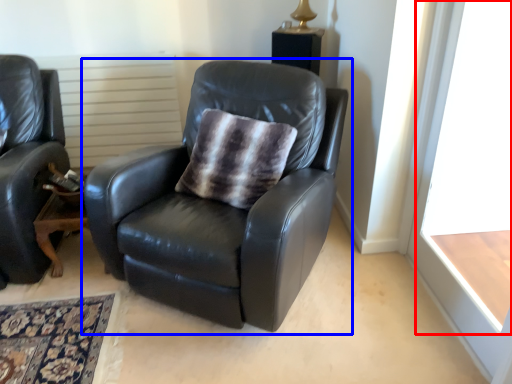
Question: Which point is closer to the camera, window frame (highlighted by a red box) or chair (highlighted by a blue box)?

Choices:
 (A) window frame
 (B) chair

Answer: (A)